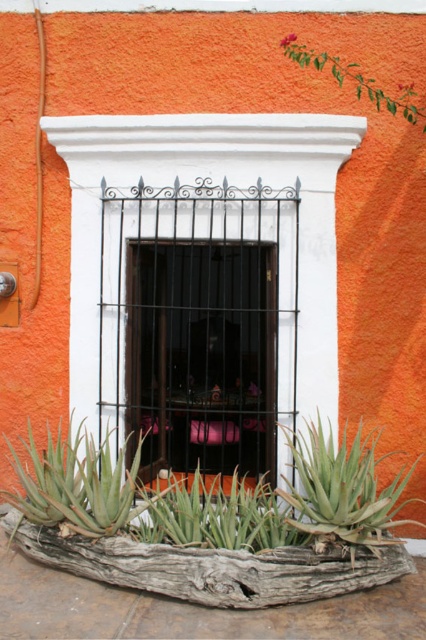
Can you confirm if green succulent at lower left is wider than green leafy branch at upper right?

Correct, the width of green succulent at lower left exceeds that of green leafy branch at upper right.

Which is in front, point (100, 493) or point (416, 109)?

Point (100, 493) is more forward.

The width and height of the screenshot is (426, 640). I want to click on green succulent at lower left, so click(x=77, y=484).

Who is higher up, green leafy plant at lower center or weathered wood log at lower center?

Positioned higher is green leafy plant at lower center.

Locate an element on the screen. Image resolution: width=426 pixels, height=640 pixels. green leafy plant at lower center is located at coordinates (210, 499).

Does weathered wood log at lower center appear over green leafy branch at upper right?

Incorrect, weathered wood log at lower center is not positioned above green leafy branch at upper right.

Is point (247, 573) positioned before point (408, 90)?

Yes.

Does point (298, 561) come behind point (403, 93)?

No, it is not.

Image resolution: width=426 pixels, height=640 pixels. I want to click on weathered wood log at lower center, so click(x=212, y=566).